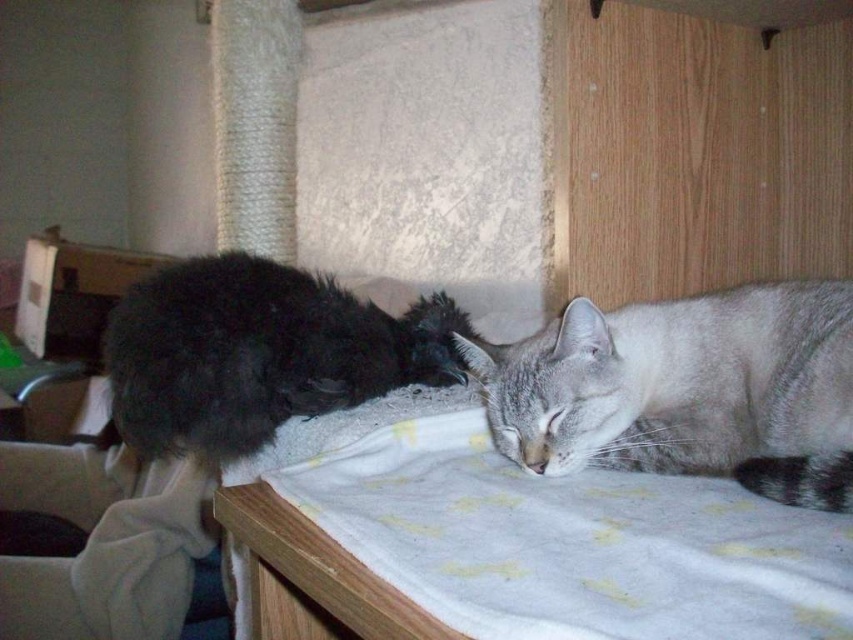
You are trying to place a small toy between the two cats on the white soft blanket at center. Based on their positions, where should you place the toy to ensure it is equidistant from both cats?

Since the white soft blanket at center is located at point (554, 532), placing the toy at this central point would ensure it is equidistant from both cats.

You are a photographer trying to capture a closeup of the white soft blanket at center without the fluffy black cat at left blocking the view. Based on the scene description, can you position yourself in a way that the blanket is visible without the cat obstructing it?

The white soft blanket at center is in front of the fluffy black cat at left, so positioning yourself behind the cat would allow you to see the blanket without obstruction.